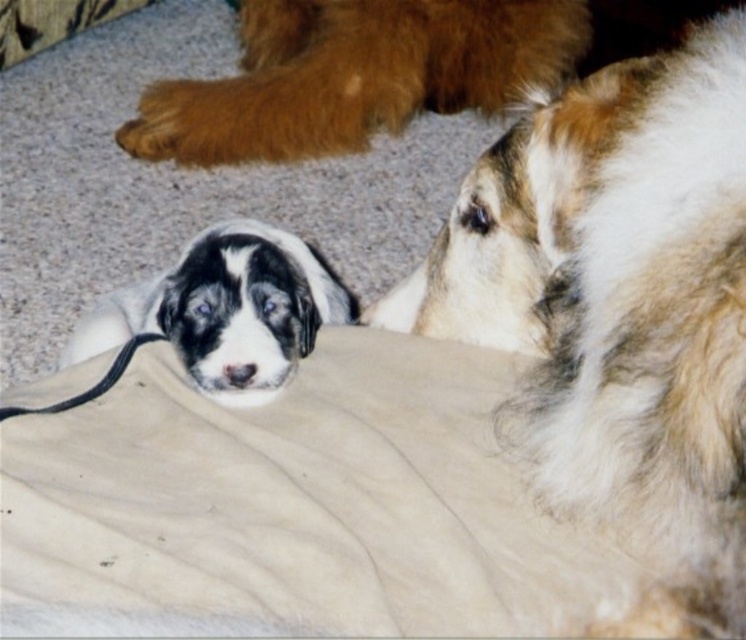
Question: Observing the image, what is the correct spatial positioning of beige fabric at center in reference to black rubber leash at lower left?

Choices:
 (A) above
 (B) below

Answer: (B)

Question: From the image, what is the correct spatial relationship of beige fabric at center in relation to fluffy white dog at upper right?

Choices:
 (A) left
 (B) right

Answer: (A)

Question: Is brown fluffy paw at upper center to the left of black rubber leash at lower left from the viewer's perspective?

Choices:
 (A) yes
 (B) no

Answer: (B)

Question: Which object is farther from the camera taking this photo?

Choices:
 (A) black rubber leash at lower left
 (B) black and white fur at center

Answer: (B)

Question: Which is nearer to the brown fluffy paw at upper center?

Choices:
 (A) fluffy white dog at upper right
 (B) black and white fur at center
 (C) black rubber leash at lower left

Answer: (B)

Question: Which object is the farthest from the fluffy white dog at upper right?

Choices:
 (A) black rubber leash at lower left
 (B) black and white fur at center
 (C) brown fluffy paw at upper center

Answer: (C)